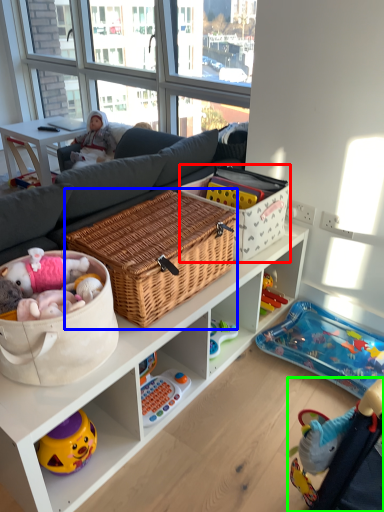
Question: Based on their relative distances, which object is nearer to storage box (highlighted by a red box)? Choose from picnic basket (highlighted by a blue box) and baby carriage (highlighted by a green box).

Choices:
 (A) picnic basket
 (B) baby carriage

Answer: (A)